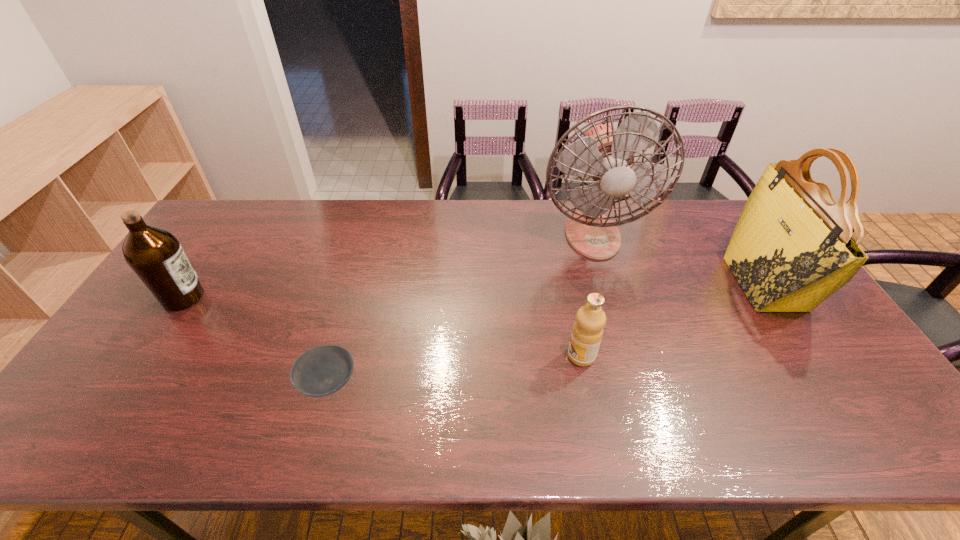
Find the location of a particular element. Image resolution: width=960 pixels, height=540 pixels. free space located 0.370m on the front-facing side of the rightmost object is located at coordinates (615, 284).

Locate an element on the screen. vacant space located 0.360m on the front-facing side of the rightmost object is located at coordinates (619, 284).

This screenshot has width=960, height=540. I want to click on vacant area situated on the label of the taller olive oil, so click(x=331, y=298).

This screenshot has height=540, width=960. Find the location of `vacant point located 0.160m on the label of the fourth tallest object`. vacant point located 0.160m on the label of the fourth tallest object is located at coordinates (505, 356).

This screenshot has height=540, width=960. I want to click on vacant space located on the label of the fourth tallest object, so click(533, 356).

Where is `free region located 0.350m on the label of the fourth tallest object`? The width and height of the screenshot is (960, 540). free region located 0.350m on the label of the fourth tallest object is located at coordinates (432, 356).

The width and height of the screenshot is (960, 540). Identify the location of free space located on the left of the bowl. coord(164,383).

Where is `fan present at the far edge`? fan present at the far edge is located at coordinates (605, 154).

This screenshot has height=540, width=960. What are the coordinates of `tote bag positioned at the far edge` in the screenshot? It's located at (793, 246).

The width and height of the screenshot is (960, 540). Identify the location of object at the left edge. (156, 256).